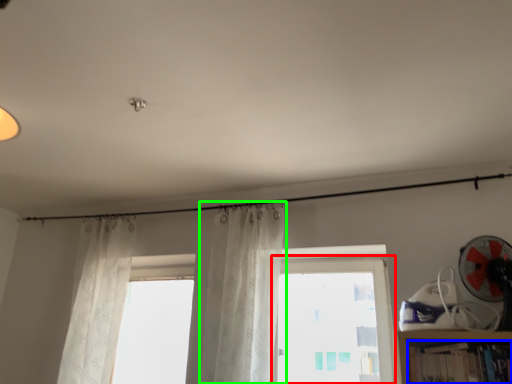
Question: Estimate the real-world distances between objects in this image. Which object is closer to window (highlighted by a red box), book (highlighted by a blue box) or curtain (highlighted by a green box)?

Choices:
 (A) book
 (B) curtain

Answer: (B)